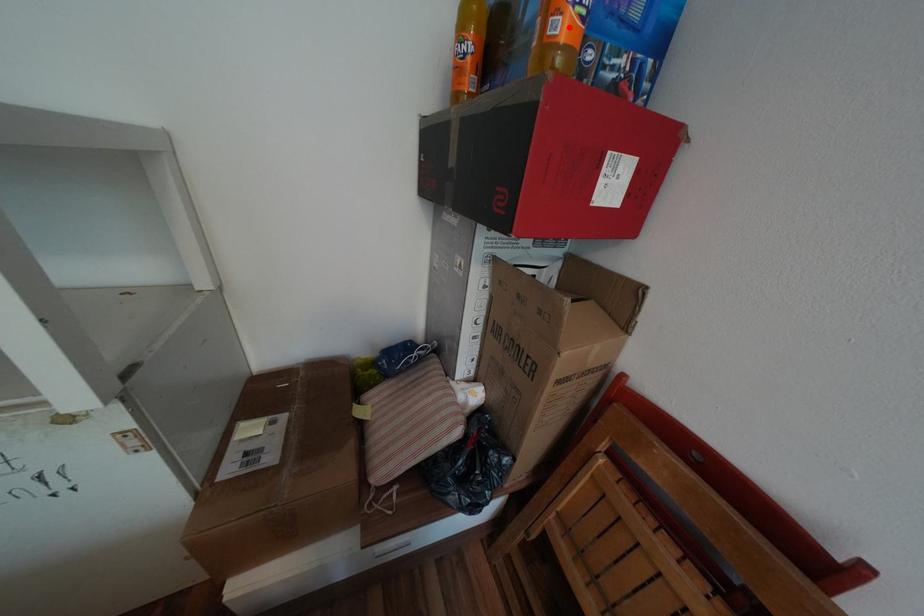
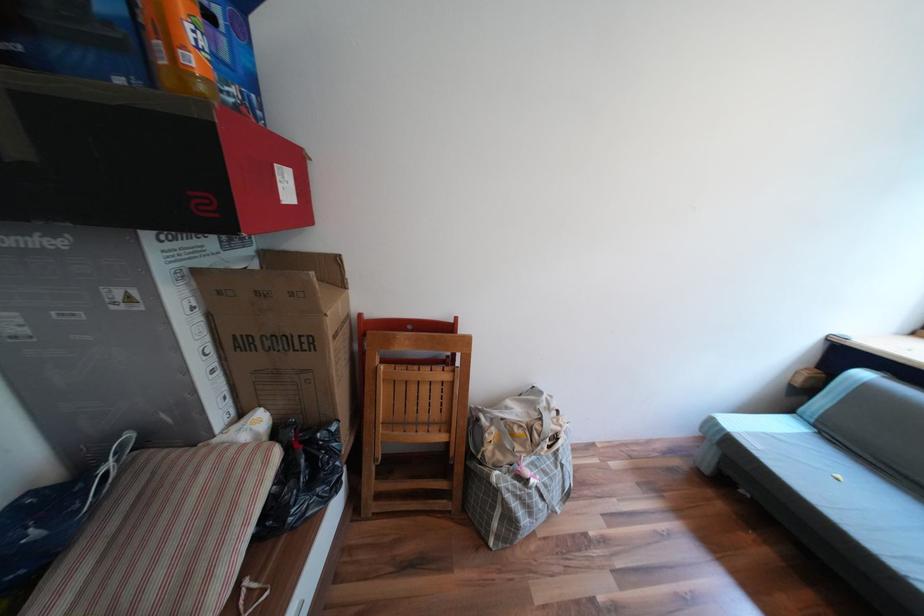
Where in the second image is the point corresponding to the highlighted location from the first image?

(201, 61)